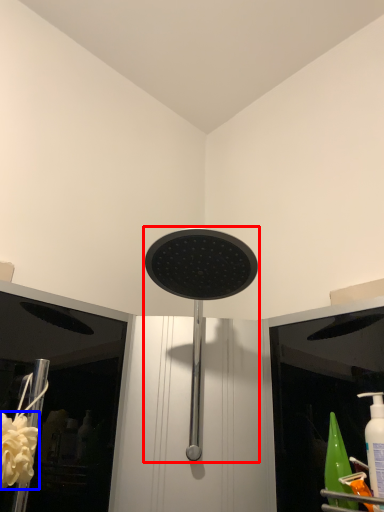
Question: Among these objects, which one is farthest to the camera, shower (highlighted by a red box) or flower (highlighted by a blue box)?

Choices:
 (A) shower
 (B) flower

Answer: (B)